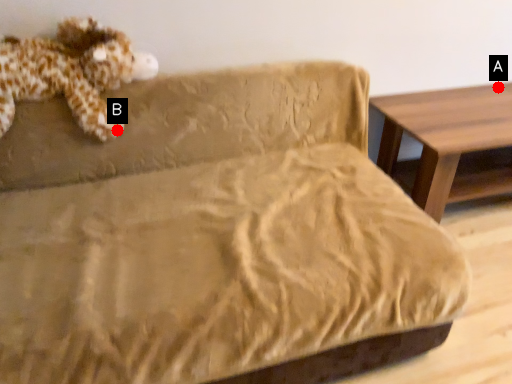
Question: Two points are circled on the image, labeled by A and B beside each circle. Which point is closer to the camera?

Choices:
 (A) A is closer
 (B) B is closer

Answer: (B)